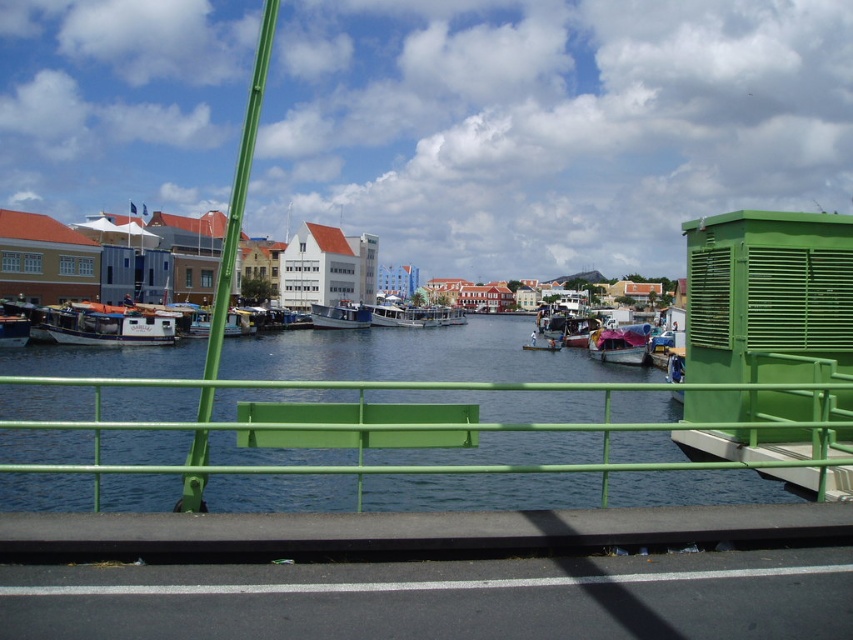
Looking at this image, you are standing at the waterfront and want to know how far the point at coordinates (119, 342) is from where you are standing. Can you determine the distance?

The distance of point (119, 342) from camera is 46.39 meters.

You are standing on the green railing and looking at the white matte boat at left and the white glossy boat at center. Which boat is positioned higher in the image?

The white matte boat at left is positioned higher in the image than the white glossy boat at center because it is above it.